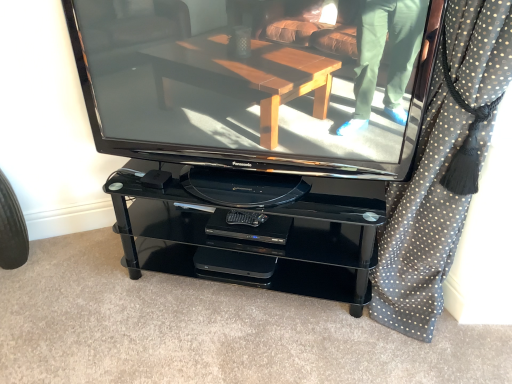
Question: Is black dotted fabric at right facing towards matte black television at center?

Choices:
 (A) no
 (B) yes

Answer: (A)

Question: Does black dotted fabric at right have a greater height compared to matte black television at center?

Choices:
 (A) no
 (B) yes

Answer: (B)

Question: Can you confirm if black dotted fabric at right is thinner than matte black television at center?

Choices:
 (A) yes
 (B) no

Answer: (B)

Question: Is black dotted fabric at right to the right of matte black television at center from the viewer's perspective?

Choices:
 (A) yes
 (B) no

Answer: (A)

Question: Is black dotted fabric at right to the left of matte black television at center from the viewer's perspective?

Choices:
 (A) no
 (B) yes

Answer: (A)

Question: Is point (418, 144) closer or farther from the camera than point (147, 109)?

Choices:
 (A) farther
 (B) closer

Answer: (B)

Question: Considering their positions, is black dotted fabric at right located in front of or behind matte black television at center?

Choices:
 (A) behind
 (B) front

Answer: (B)

Question: Which is correct: black dotted fabric at right is inside matte black television at center, or outside of it?

Choices:
 (A) inside
 (B) outside

Answer: (B)

Question: In terms of height, does black dotted fabric at right look taller or shorter compared to matte black television at center?

Choices:
 (A) short
 (B) tall

Answer: (B)

Question: Looking at the image, does matte black television at center seem bigger or smaller compared to black dotted fabric at right?

Choices:
 (A) big
 (B) small

Answer: (B)

Question: From the image's perspective, is matte black television at center positioned above or below black dotted fabric at right?

Choices:
 (A) above
 (B) below

Answer: (A)

Question: Does point (369, 137) appear closer or farther from the camera than point (370, 304)?

Choices:
 (A) farther
 (B) closer

Answer: (B)

Question: In terms of width, does matte black television at center look wider or thinner when compared to black dotted fabric at right?

Choices:
 (A) wide
 (B) thin

Answer: (B)

Question: From the image's perspective, is matte black television at center positioned above or below black rubber tire at lower left?

Choices:
 (A) above
 (B) below

Answer: (A)

Question: Do you think matte black television at center is within black rubber tire at lower left, or outside of it?

Choices:
 (A) inside
 (B) outside

Answer: (B)